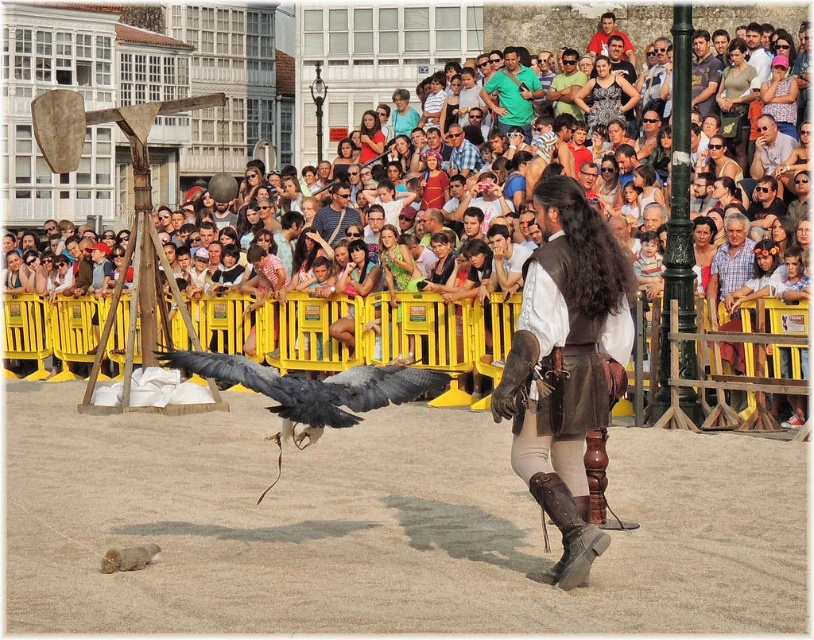
Can you confirm if matte black shirt at center is bigger than blue plaid shirt at center?

No.

Is point (339, 195) in front of point (462, 163)?

Yes, it is in front of point (462, 163).

Between point (318, 211) and point (456, 134), which one is positioned behind?

The point (456, 134) is more distant.

Identify the location of matte black shirt at center. (335, 214).

Does point (225, 120) come closer to viewer compared to point (311, 403)?

No.

Does point (473, 22) come farther from viewer compared to point (168, 364)?

Yes.

Find the location of a particular element. The height and width of the screenshot is (640, 814). multicolored fabric crowd at upper center is located at coordinates (432, 45).

Is dark gray feathers at center closer to the viewer compared to brown leather jacket at center?

Yes, it is in front of brown leather jacket at center.

The height and width of the screenshot is (640, 814). What do you see at coordinates (313, 388) in the screenshot?
I see `dark gray feathers at center` at bounding box center [313, 388].

Where is `dark gray feathers at center`? The image size is (814, 640). dark gray feathers at center is located at coordinates (313, 388).